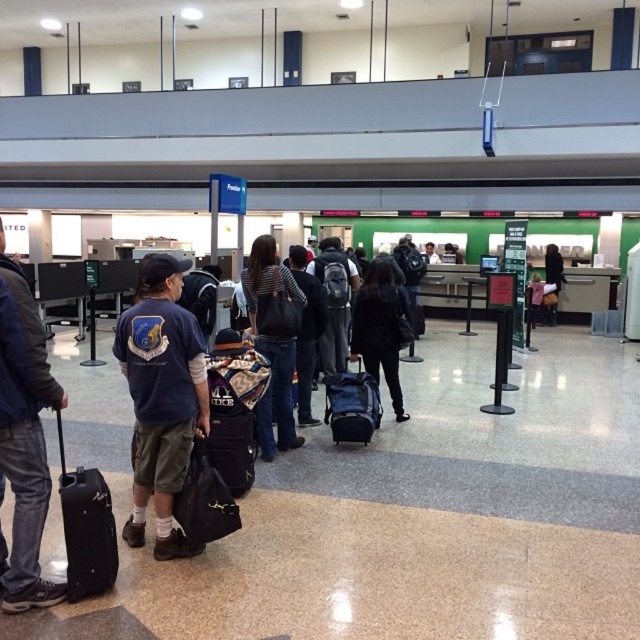
Question: Which point appears closest to the camera in this image?

Choices:
 (A) (186, 401)
 (B) (392, 276)

Answer: (A)

Question: Is striped fabric shirt at center bigger than purple fabric suitcase at center?

Choices:
 (A) yes
 (B) no

Answer: (A)

Question: Is black matte backpack at center further to the viewer compared to black leather jacket at center?

Choices:
 (A) yes
 (B) no

Answer: (B)

Question: Can you confirm if navy blue shirt at center is smaller than black leather jacket at center?

Choices:
 (A) no
 (B) yes

Answer: (A)

Question: Which point is farther to the camera?

Choices:
 (A) blue fabric suitcase at center
 (B) purple fabric suitcase at center

Answer: (A)

Question: Which point is farther to the camera?

Choices:
 (A) purple fabric suitcase at center
 (B) blue fabric suitcase at center

Answer: (B)